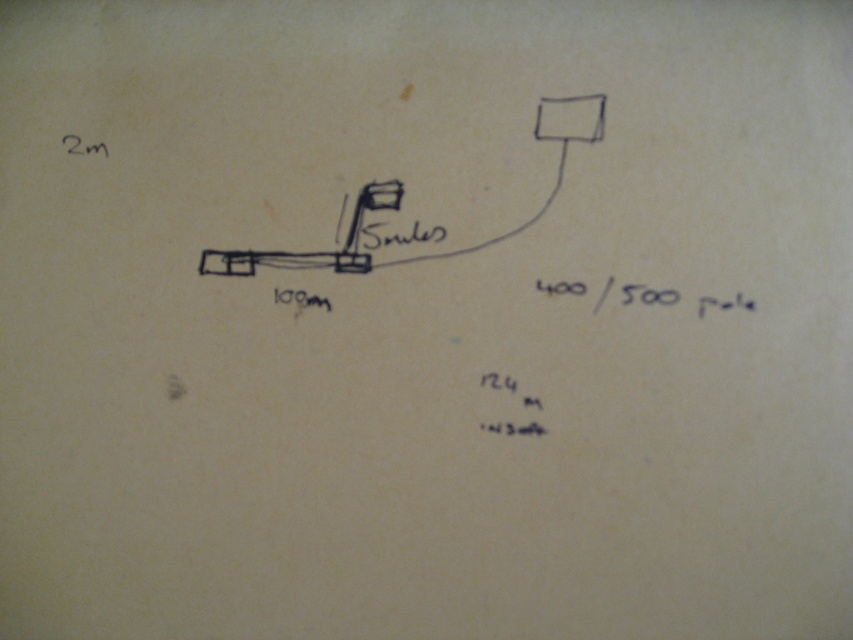
Can you confirm if black paper at lower center is taller than black ink writing at center?

Yes, black paper at lower center is taller than black ink writing at center.

Is black paper at lower center bigger than black ink writing at center?

Yes, black paper at lower center is bigger than black ink writing at center.

Does point (529, 403) lie behind point (296, 300)?

No, it is in front of (296, 300).

Where is `black paper at lower center`? This screenshot has width=853, height=640. black paper at lower center is located at coordinates [518, 406].